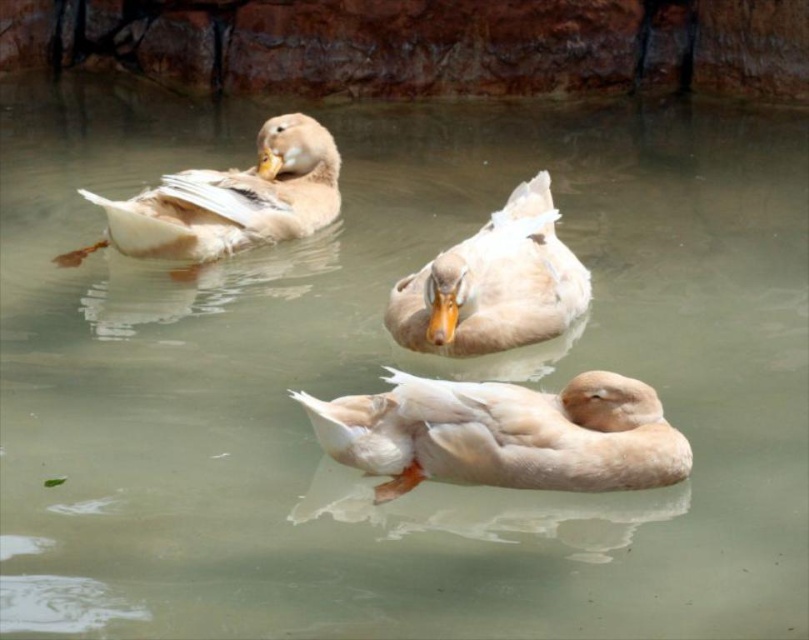
Can you confirm if light brown feathered duck at center is taller than light brown feathered duck at upper left?

Incorrect, light brown feathered duck at center's height is not larger of light brown feathered duck at upper left's.

Measure the distance between light brown feathered duck at center and camera.

light brown feathered duck at center is 12.31 feet from camera.

Locate an element on the screen. This screenshot has height=640, width=809. light brown feathered duck at center is located at coordinates (503, 435).

Is light brown feathered duck at center below white matte duck at center?

Yes.

Does point (460, 432) come farther from viewer compared to point (441, 289)?

No, it is in front of (441, 289).

This screenshot has height=640, width=809. I want to click on light brown feathered duck at center, so click(503, 435).

Is white matte duck at center positioned before light brown feathered duck at upper left?

Yes, white matte duck at center is in front of light brown feathered duck at upper left.

Is white matte duck at center further to the viewer compared to light brown feathered duck at upper left?

No, white matte duck at center is closer to the viewer.

Is point (551, 317) positioned in front of point (318, 211)?

Yes, point (551, 317) is in front of point (318, 211).

Where is `white matte duck at center`? This screenshot has height=640, width=809. white matte duck at center is located at coordinates (493, 284).